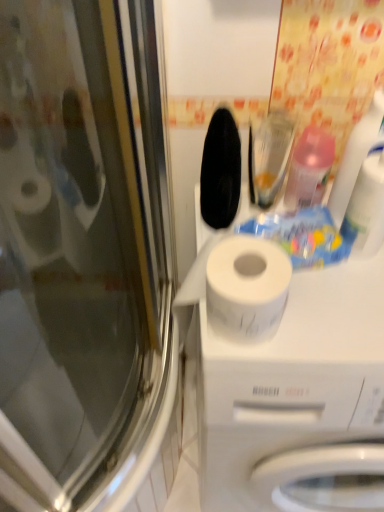
This screenshot has height=512, width=384. What are the coordinates of `vacant space in front of translucent plastic spray bottle at upper right, the second cleaning product positioned from the left` in the screenshot? It's located at (340, 305).